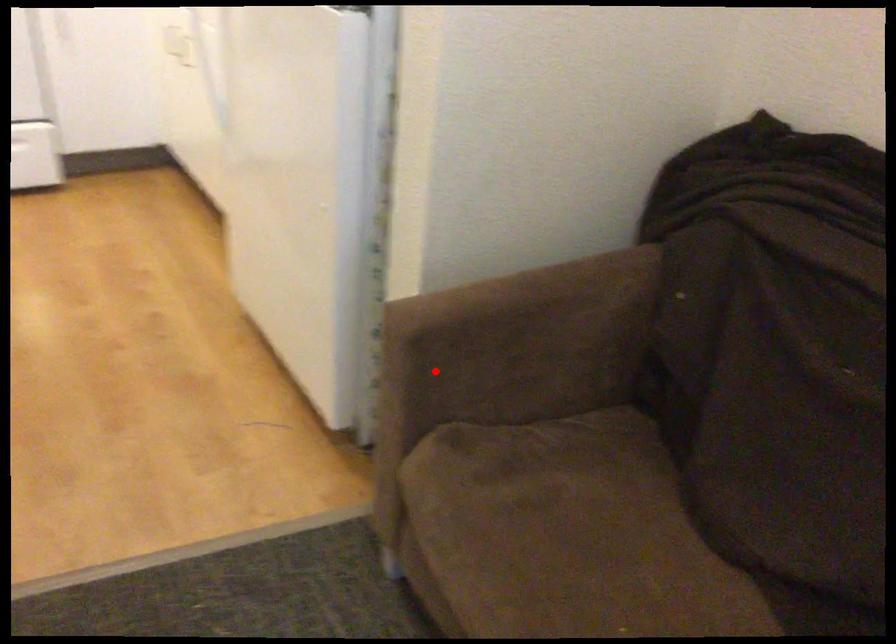
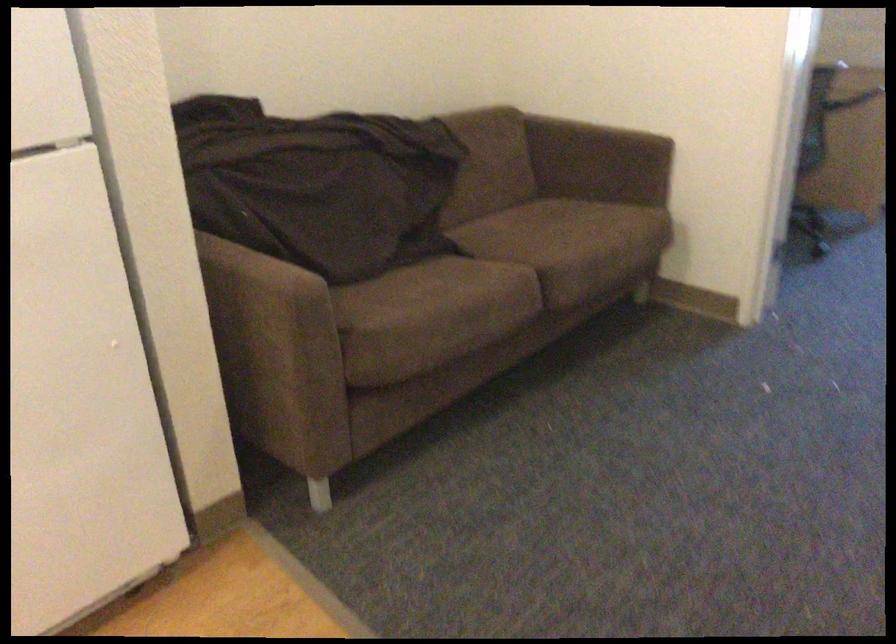
Find the pixel in the second image that matches the highlighted location in the first image.

(271, 342)